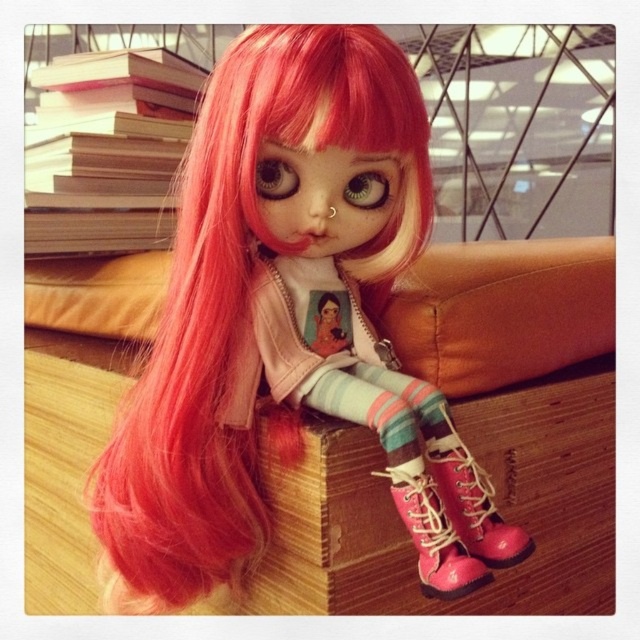
Question: Can you confirm if pink leather boot at lower right is thinner than pink leather boot at lower center?

Choices:
 (A) no
 (B) yes

Answer: (A)

Question: From the image, what is the correct spatial relationship of pink matte wig at upper left in relation to pink leather boot at lower right?

Choices:
 (A) above
 (B) below

Answer: (A)

Question: Which point is farther from the camera taking this photo?

Choices:
 (A) (221, 579)
 (B) (458, 456)

Answer: (A)

Question: Among these objects, which one is nearest to the camera?

Choices:
 (A) pink leather boot at lower center
 (B) pink leather boot at lower right
 (C) pink matte wig at upper left

Answer: (A)

Question: Which point is farther to the camera?

Choices:
 (A) pink leather boot at lower right
 (B) pink matte wig at upper left

Answer: (A)

Question: Is pink matte wig at upper left to the left of pink leather boot at lower right from the viewer's perspective?

Choices:
 (A) yes
 (B) no

Answer: (A)